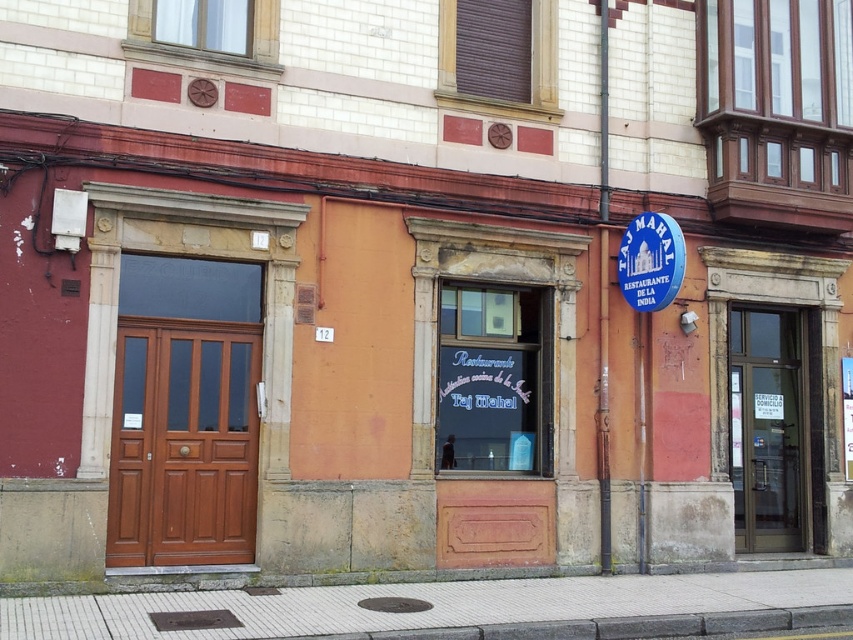
Question: Among these objects, which one is nearest to the camera?

Choices:
 (A) blue plastic sign at upper right
 (B) brown wooden door at center
 (C) matte brown door at right
 (D) blue plastic sign at upper center

Answer: (B)

Question: In this image, where is matte brown door at right located relative to blue plastic sign at upper right?

Choices:
 (A) left
 (B) right

Answer: (B)

Question: Does brown wooden door at center appear under blue plastic sign at upper right?

Choices:
 (A) no
 (B) yes

Answer: (B)

Question: Which point is closer to the camera taking this photo?

Choices:
 (A) (628, 227)
 (B) (141, 330)

Answer: (B)

Question: Which point is closer to the camera?

Choices:
 (A) (254, 483)
 (B) (630, 256)
 (C) (730, 326)

Answer: (A)

Question: Is matte brown door at right to the left of blue plastic sign at upper right from the viewer's perspective?

Choices:
 (A) no
 (B) yes

Answer: (A)